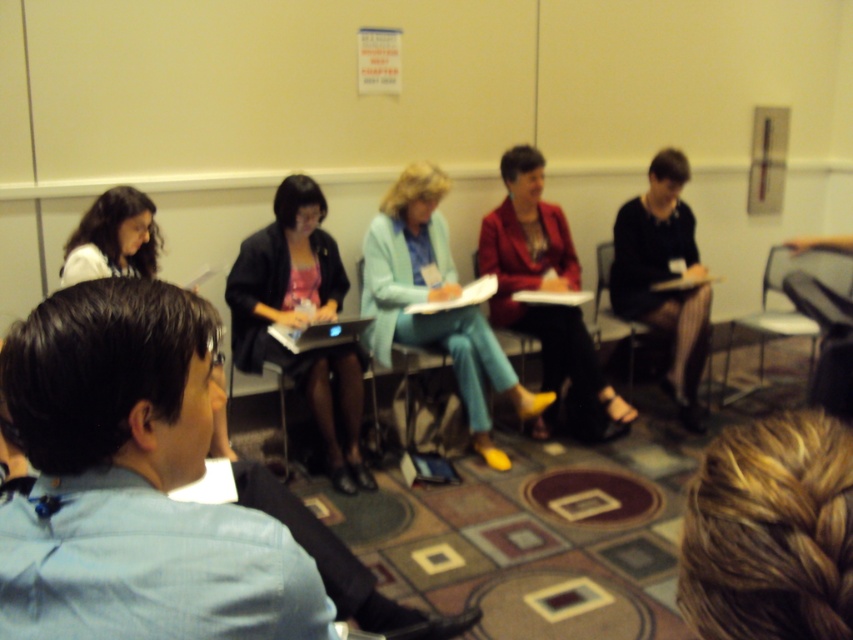
Is matte red blazer at center above metallic silver chair at right?

Yes.

Who is higher up, matte red blazer at center or metallic silver chair at right?

Positioned higher is matte red blazer at center.

Which is in front, point (502, 312) or point (775, 273)?

Point (502, 312) is more forward.

I want to click on matte red blazer at center, so pyautogui.click(x=546, y=289).

Between blonde braided hair at center and metallic silver chair at right, which one appears on the left side from the viewer's perspective?

blonde braided hair at center is more to the left.

Who is positioned more to the right, blonde braided hair at center or metallic silver chair at right?

From the viewer's perspective, metallic silver chair at right appears more on the right side.

Does point (706, 552) come closer to viewer compared to point (813, 250)?

Yes, point (706, 552) is closer to viewer.

In order to click on blonde braided hair at center in this screenshot , I will do `click(770, 531)`.

Between matte black jacket at center and matte white shirt at left, which one appears on the left side from the viewer's perspective?

matte white shirt at left

Is matte black jacket at center to the right of matte white shirt at left from the viewer's perspective?

Yes, matte black jacket at center is to the right of matte white shirt at left.

Describe the element at coordinates (300, 317) in the screenshot. I see `matte black jacket at center` at that location.

Identify the location of matte black jacket at center. (x=300, y=317).